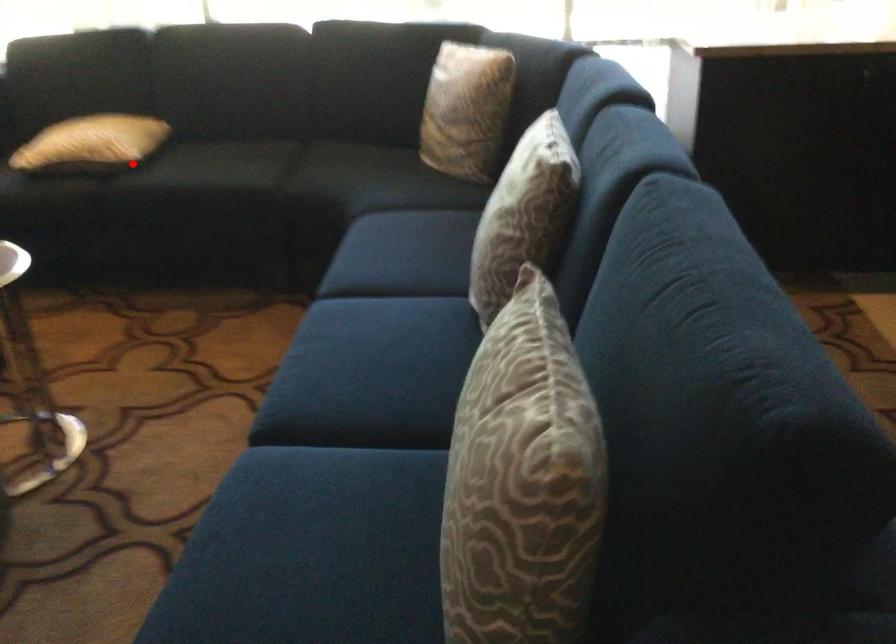
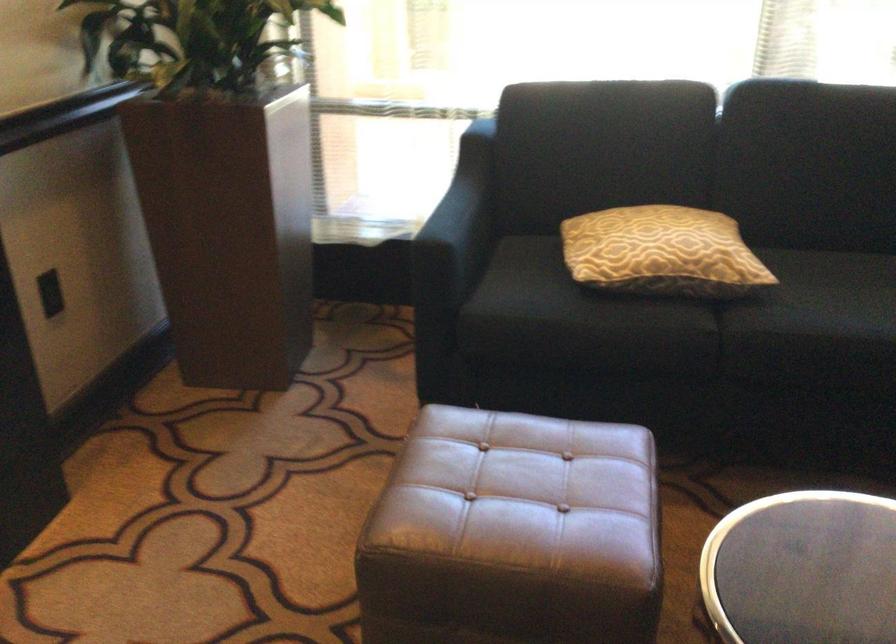
The point at the highlighted location is marked in the first image. Where is the corresponding point in the second image?

(752, 289)